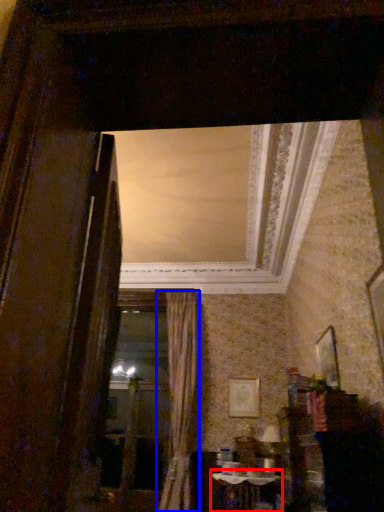
Question: Which of the following is the closest to the observer, table (highlighted by a red box) or curtain (highlighted by a blue box)?

Choices:
 (A) table
 (B) curtain

Answer: (A)